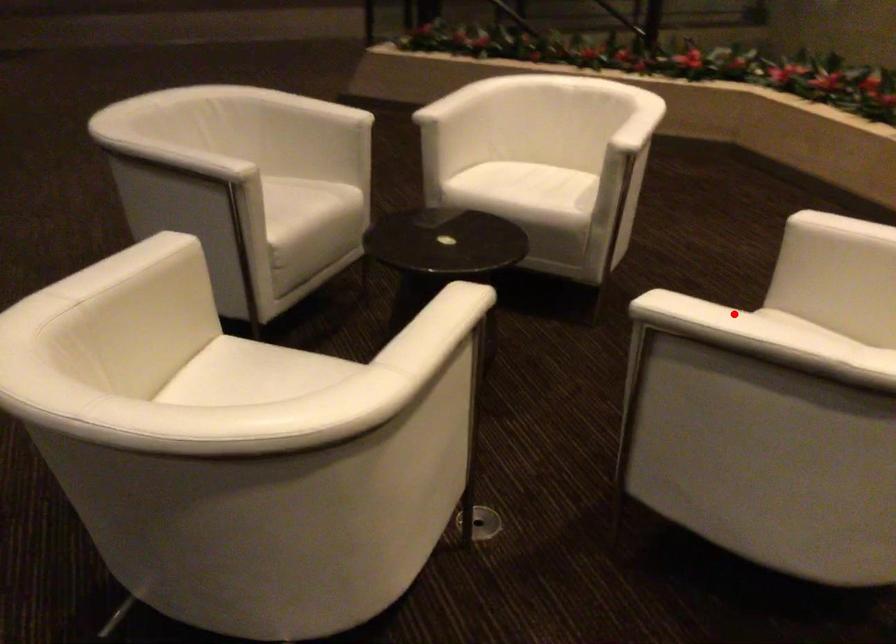
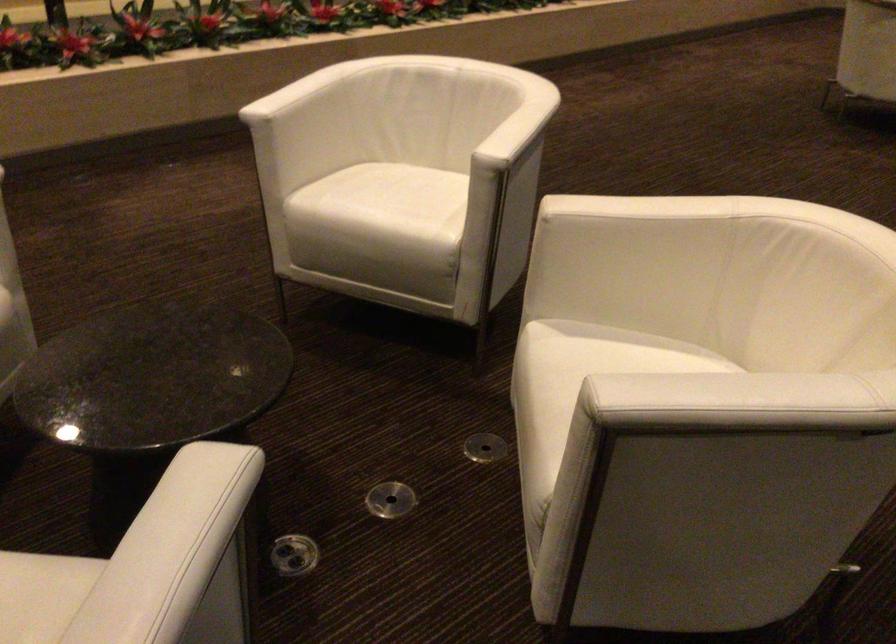
Question: A red point is marked in image1. In image2, is the corresponding 3D point closer to the camera or farther? Reply with the corresponding letter.

Choices:
 (A) The corresponding 3D point is closer.
 (B) The corresponding 3D point is farther.

Answer: (B)